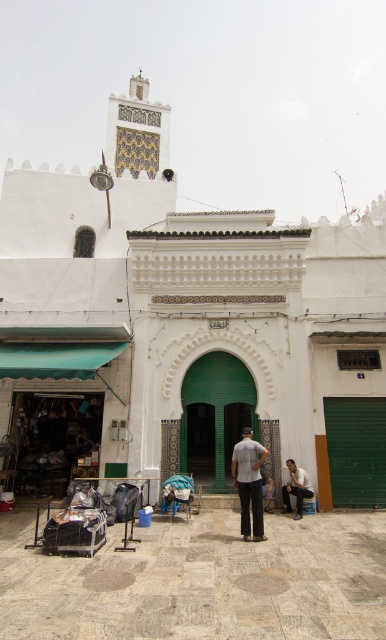
You are standing in front of the mosque and need to find the light gray cotton pants at center. Based on the scene description, where would you look relative to the entrance?

The light gray cotton pants at center is located at point 0.755 on the horizontal axis and 0.645 on the vertical axis relative to the entrance.

You are standing in front of the mosque and need to place a 40 feet long banner between the white textured wall at center and the white cotton shirt at lower right. Is there enough space?

The white textured wall at center and white cotton shirt at lower right are 38.22 feet apart from each other. Since the banner is 40 feet long, it would be 1.78 feet too long to fit between them.